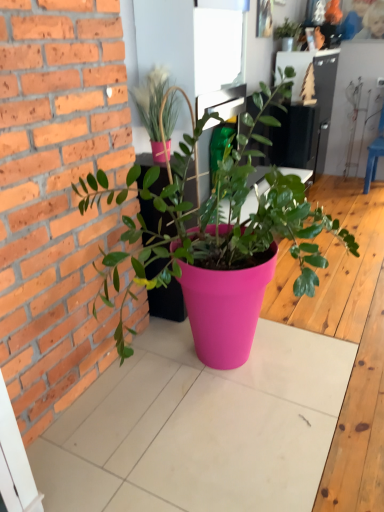
Question: Would you say matte green plant at upper center, the 3th houseplant viewed from the front, contains pink plastic pot at center, arranged as the third houseplant when viewed from the back?

Choices:
 (A) no
 (B) yes

Answer: (A)

Question: Is pink plastic pot at center, marked as the 1th houseplant in a bottom-to-top arrangement, at the back of matte green plant at upper center, the third houseplant when ordered from bottom to top?

Choices:
 (A) no
 (B) yes

Answer: (A)

Question: Would you say matte green plant at upper center, the third houseplant when ordered from bottom to top, is a long distance from pink plastic pot at center, arranged as the first houseplant when viewed from the front?

Choices:
 (A) yes
 (B) no

Answer: (A)

Question: Is matte green plant at upper center, the first houseplant positioned from the top, oriented towards pink plastic pot at center, arranged as the first houseplant when viewed from the front?

Choices:
 (A) no
 (B) yes

Answer: (A)

Question: From the image's perspective, would you say matte green plant at upper center, which ranks as the first houseplant in back-to-front order, is positioned over pink plastic pot at center, arranged as the third houseplant when viewed from the back?

Choices:
 (A) yes
 (B) no

Answer: (A)

Question: Looking at the image, does pink plastic pot at center, arranged as the first houseplant when viewed from the front, seem bigger or smaller compared to matte pink pot at upper center, which is the 2th houseplant from back to front?

Choices:
 (A) big
 (B) small

Answer: (A)

Question: Based on their positions, is pink plastic pot at center, arranged as the third houseplant when viewed from the back, located to the left or right of matte pink pot at upper center, the second houseplant in the front-to-back sequence?

Choices:
 (A) left
 (B) right

Answer: (B)

Question: Considering the positions of point (221, 320) and point (140, 100), is point (221, 320) closer or farther from the camera than point (140, 100)?

Choices:
 (A) closer
 (B) farther

Answer: (A)

Question: Considering their positions, is pink plastic pot at center, marked as the 1th houseplant in a bottom-to-top arrangement, located in front of or behind matte pink pot at upper center, arranged as the second houseplant when viewed from the top?

Choices:
 (A) front
 (B) behind

Answer: (A)

Question: From their relative heights in the image, would you say pink plastic pot at center, acting as the 3th houseplant starting from the top, is taller or shorter than blue plastic chair at right?

Choices:
 (A) tall
 (B) short

Answer: (A)

Question: Do you think pink plastic pot at center, marked as the 1th houseplant in a bottom-to-top arrangement, is within blue plastic chair at right, or outside of it?

Choices:
 (A) inside
 (B) outside

Answer: (B)

Question: From a real-world perspective, is pink plastic pot at center, arranged as the third houseplant when viewed from the back, above or below blue plastic chair at right?

Choices:
 (A) above
 (B) below

Answer: (A)

Question: Is pink plastic pot at center, marked as the 1th houseplant in a bottom-to-top arrangement, in front of or behind blue plastic chair at right in the image?

Choices:
 (A) behind
 (B) front

Answer: (B)

Question: Is pink plastic pot at center, arranged as the first houseplant when viewed from the front, inside the boundaries of matte green plant at upper center, the third houseplant when ordered from bottom to top, or outside?

Choices:
 (A) outside
 (B) inside

Answer: (A)

Question: From their relative heights in the image, would you say pink plastic pot at center, arranged as the third houseplant when viewed from the back, is taller or shorter than matte green plant at upper center, the third houseplant when ordered from bottom to top?

Choices:
 (A) short
 (B) tall

Answer: (B)